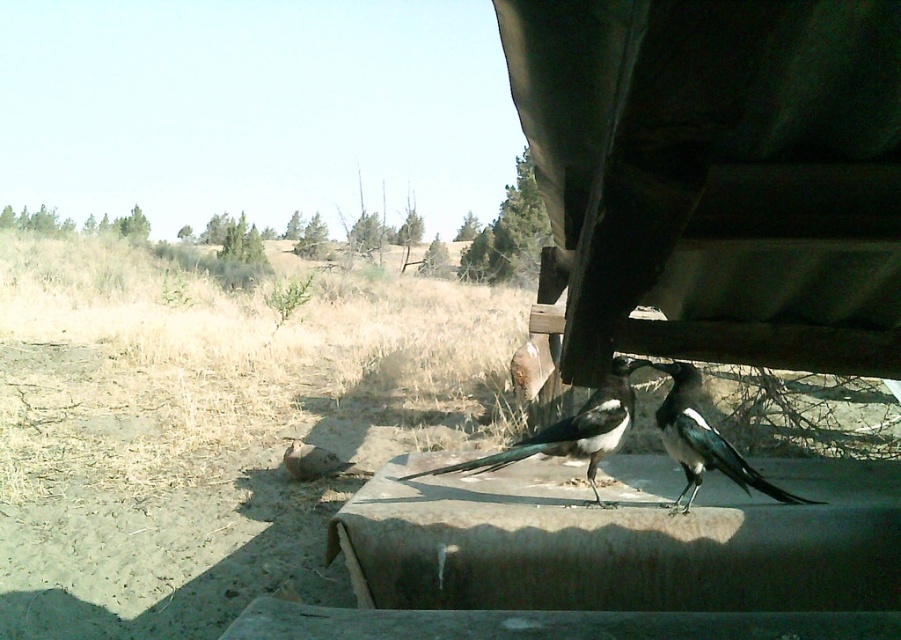
Which is behind, point (443, 467) or point (671, 365)?

Positioned behind is point (443, 467).

Is black glossy magpie at center wider than black glossy magpie at lower right?

Indeed, black glossy magpie at center has a greater width compared to black glossy magpie at lower right.

Find the location of a particular element. This screenshot has width=901, height=640. black glossy magpie at center is located at coordinates (572, 429).